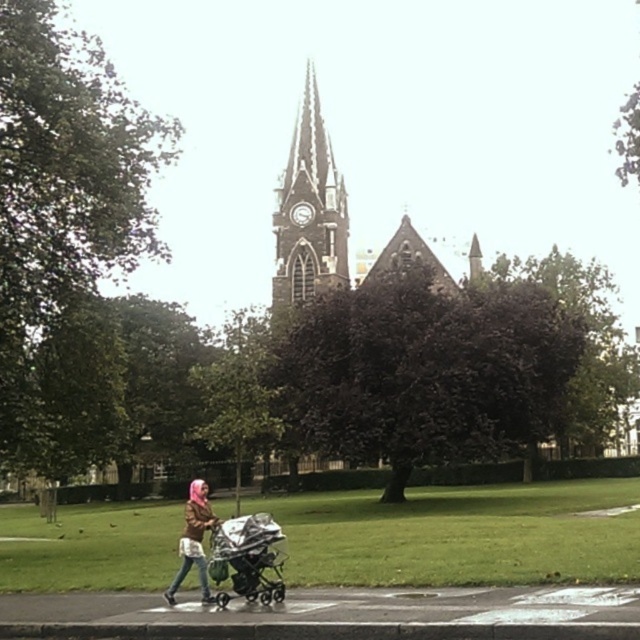
Between metallic silver stroller at center and pink fabric baby stroller at lower center, which one has less height?

Standing shorter between the two is metallic silver stroller at center.

Find the location of a particular element. The width and height of the screenshot is (640, 640). metallic silver stroller at center is located at coordinates [x=248, y=556].

Who is more distant from viewer, (340,200) or (220,577)?

The point (340,200) is behind.

In the scene shown: Which is above, dark brown stone clock tower at center or metallic silver stroller at center?

Positioned higher is dark brown stone clock tower at center.

I want to click on dark brown stone clock tower at center, so click(x=308, y=211).

This screenshot has width=640, height=640. Identify the location of dark brown stone clock tower at center. (308, 211).

Between dark brown stone clock tower at center and pink fabric baby stroller at lower center, which one is positioned lower?

Positioned lower is pink fabric baby stroller at lower center.

Between dark brown stone clock tower at center and pink fabric baby stroller at lower center, which one appears on the left side from the viewer's perspective?

pink fabric baby stroller at lower center

Does point (285, 246) lie behind point (200, 490)?

Yes, point (285, 246) is behind point (200, 490).

Identify the location of dark brown stone clock tower at center. The width and height of the screenshot is (640, 640). (308, 211).